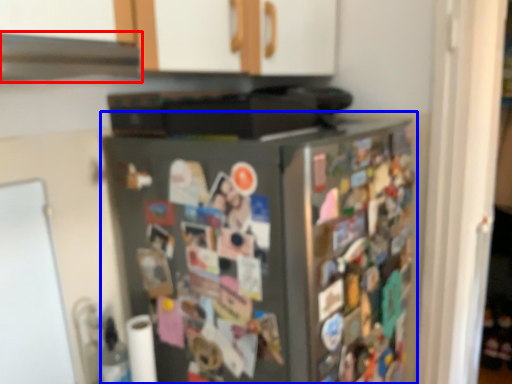
Question: Which point is closer to the camera, exhaust hood (highlighted by a red box) or refrigerator (highlighted by a blue box)?

Choices:
 (A) exhaust hood
 (B) refrigerator

Answer: (A)